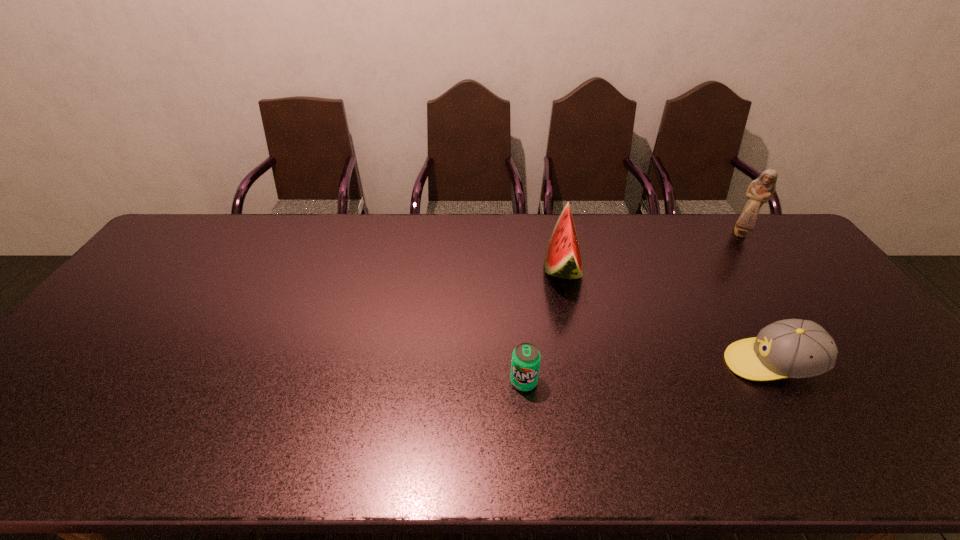
Where is `free point that satisfies the following two spatial constraints: 1. on the front-facing side of the third object from left to right; 2. on the front-facing side of the pop soda`? free point that satisfies the following two spatial constraints: 1. on the front-facing side of the third object from left to right; 2. on the front-facing side of the pop soda is located at coordinates (782, 382).

Where is `free space that satisfies the following two spatial constraints: 1. on the front-facing side of the figurine; 2. on the front-facing side of the baseball cap`? The image size is (960, 540). free space that satisfies the following two spatial constraints: 1. on the front-facing side of the figurine; 2. on the front-facing side of the baseball cap is located at coordinates (836, 364).

Locate an element on the screen. The height and width of the screenshot is (540, 960). free space that satisfies the following two spatial constraints: 1. on the front-facing side of the rightmost object; 2. on the outer rind of the third shortest object is located at coordinates (764, 266).